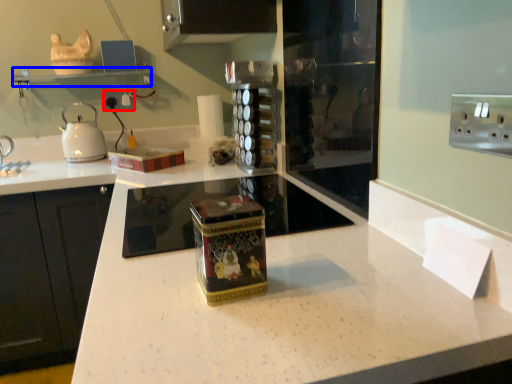
Question: Among these objects, which one is farthest to the camera, electric outlet (highlighted by a red box) or shelf (highlighted by a blue box)?

Choices:
 (A) electric outlet
 (B) shelf

Answer: (A)